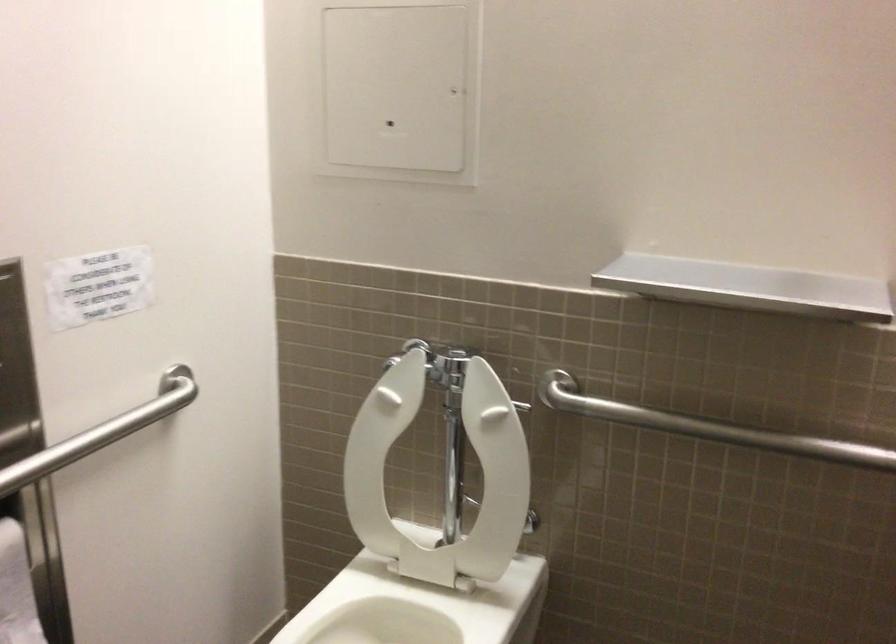
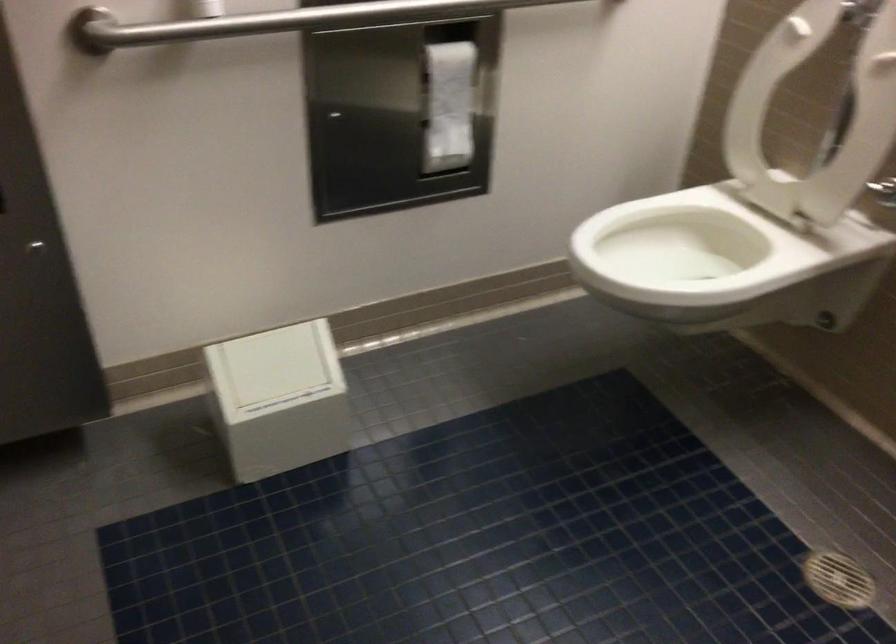
In the second image, find the point that corresponds to the point at 423,466 in the first image.

(814, 115)